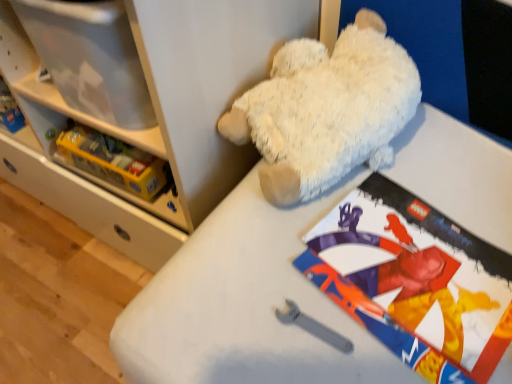
Question: Is yellow plastic lego box at left, the second shelf in the front-to-back sequence, to the right of white plush bear at upper right, acting as the first shelf starting from the front, from the viewer's perspective?

Choices:
 (A) yes
 (B) no

Answer: (A)

Question: From the image's perspective, is yellow plastic lego box at left, arranged as the 1th shelf when viewed from the back, above white plush bear at upper right, the second shelf when ordered from back to front?

Choices:
 (A) yes
 (B) no

Answer: (B)

Question: Considering the relative sizes of yellow plastic lego box at left, arranged as the 1th shelf when viewed from the back, and white plush bear at upper right, the second shelf when ordered from back to front, in the image provided, is yellow plastic lego box at left, arranged as the 1th shelf when viewed from the back, thinner than white plush bear at upper right, the second shelf when ordered from back to front,?

Choices:
 (A) no
 (B) yes

Answer: (B)

Question: From the image's perspective, is yellow plastic lego box at left, the second shelf in the front-to-back sequence, beneath white plush bear at upper right, the second shelf when ordered from back to front?

Choices:
 (A) yes
 (B) no

Answer: (A)

Question: Is white plush bear at upper right, acting as the first shelf starting from the front, completely or partially inside yellow plastic lego box at left, the second shelf in the front-to-back sequence?

Choices:
 (A) no
 (B) yes

Answer: (A)

Question: Considering their positions, is white plush teddy bear at upper center located in front of or behind white plush bear at upper right, the second shelf when ordered from back to front?

Choices:
 (A) front
 (B) behind

Answer: (B)

Question: From a real-world perspective, relative to white plush bear at upper right, the second shelf when ordered from back to front, is white plush teddy bear at upper center vertically above or below?

Choices:
 (A) above
 (B) below

Answer: (A)

Question: Is point (412, 102) positioned closer to the camera than point (53, 92)?

Choices:
 (A) closer
 (B) farther

Answer: (A)

Question: In terms of width, does white plush teddy bear at upper center look wider or thinner when compared to white plush bear at upper right, the second shelf when ordered from back to front?

Choices:
 (A) wide
 (B) thin

Answer: (B)

Question: Is white plush bear at upper right, the second shelf when ordered from back to front, wider or thinner than yellow plastic lego box at left, arranged as the 1th shelf when viewed from the back?

Choices:
 (A) wide
 (B) thin

Answer: (A)

Question: From their relative heights in the image, would you say white plush bear at upper right, acting as the first shelf starting from the front, is taller or shorter than yellow plastic lego box at left, the second shelf in the front-to-back sequence?

Choices:
 (A) tall
 (B) short

Answer: (A)

Question: Relative to yellow plastic lego box at left, arranged as the 1th shelf when viewed from the back, is white plush bear at upper right, acting as the first shelf starting from the front, in front or behind?

Choices:
 (A) front
 (B) behind

Answer: (A)

Question: Does point (139, 140) appear closer or farther from the camera than point (145, 203)?

Choices:
 (A) farther
 (B) closer

Answer: (B)

Question: Considering the positions of matte paper comic book at upper center and yellow plastic lego box at left, arranged as the 1th shelf when viewed from the back, in the image, is matte paper comic book at upper center taller or shorter than yellow plastic lego box at left, arranged as the 1th shelf when viewed from the back,?

Choices:
 (A) short
 (B) tall

Answer: (B)

Question: In the image, is matte paper comic book at upper center positioned in front of or behind yellow plastic lego box at left, arranged as the 1th shelf when viewed from the back?

Choices:
 (A) behind
 (B) front

Answer: (B)